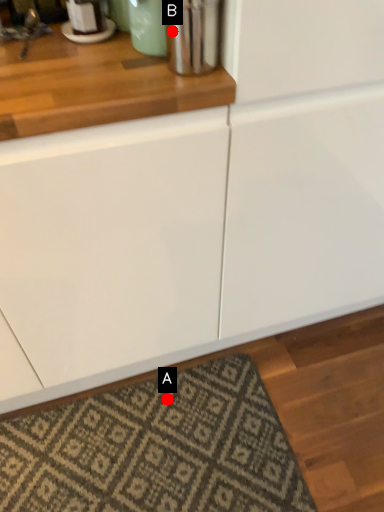
Question: Two points are circled on the image, labeled by A and B beside each circle. Which point appears closest to the camera in this image?

Choices:
 (A) A is closer
 (B) B is closer

Answer: (B)